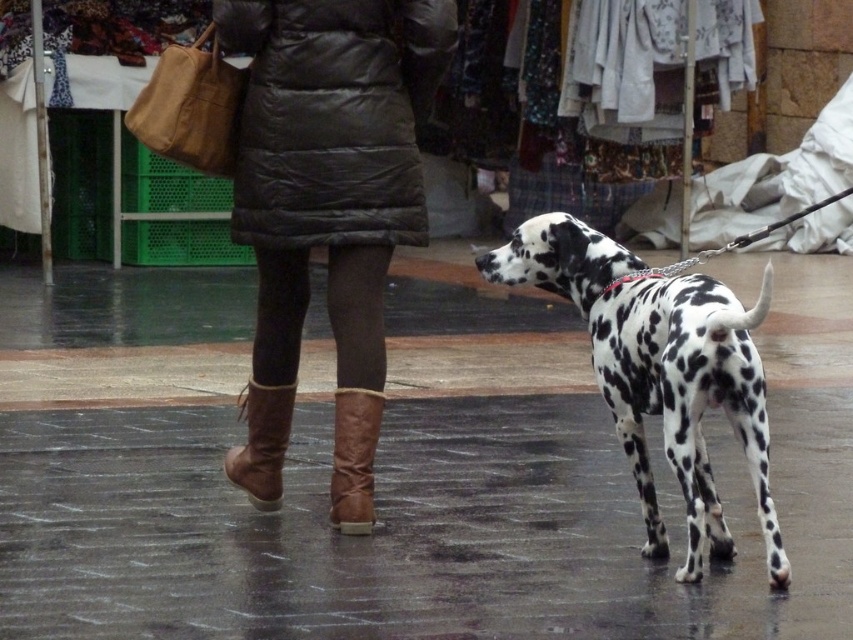
Is leather boots at center to the right of brown suede boot at lower center from the viewer's perspective?

Incorrect, leather boots at center is not on the right side of brown suede boot at lower center.

Between leather boots at center and brown suede boot at lower center, which one appears on the right side from the viewer's perspective?

From the viewer's perspective, brown suede boot at lower center appears more on the right side.

This screenshot has width=853, height=640. Describe the element at coordinates (328, 209) in the screenshot. I see `leather boots at center` at that location.

Image resolution: width=853 pixels, height=640 pixels. What are the coordinates of `leather boots at center` in the screenshot? It's located at (328, 209).

Is white-spotted fur dog at right wider than leather boots at lower center?

Yes.

Between white-spotted fur dog at right and leather boots at lower center, which one has more height?

white-spotted fur dog at right is taller.

The image size is (853, 640). Describe the element at coordinates (660, 371) in the screenshot. I see `white-spotted fur dog at right` at that location.

Find the location of a particular element. Image resolution: width=853 pixels, height=640 pixels. white-spotted fur dog at right is located at coordinates (660, 371).

Between leather boots at center and white-spotted fur dog at right, which one is positioned lower?

white-spotted fur dog at right is lower down.

Which of these two, leather boots at center or white-spotted fur dog at right, stands taller?

leather boots at center is taller.

Image resolution: width=853 pixels, height=640 pixels. In order to click on leather boots at center in this screenshot , I will do `click(328, 209)`.